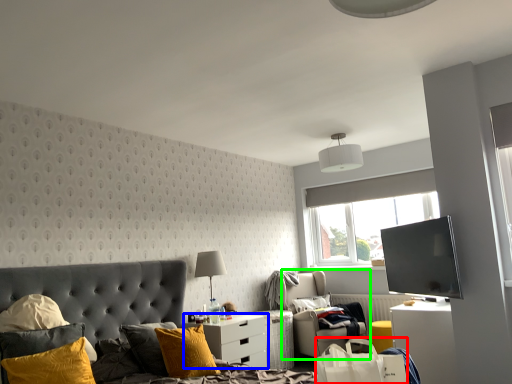
Question: Which object is positioned closest to shopping bag (highlighted by a red box)? Select from nightstand (highlighted by a blue box) and chair (highlighted by a green box).

Choices:
 (A) nightstand
 (B) chair

Answer: (A)